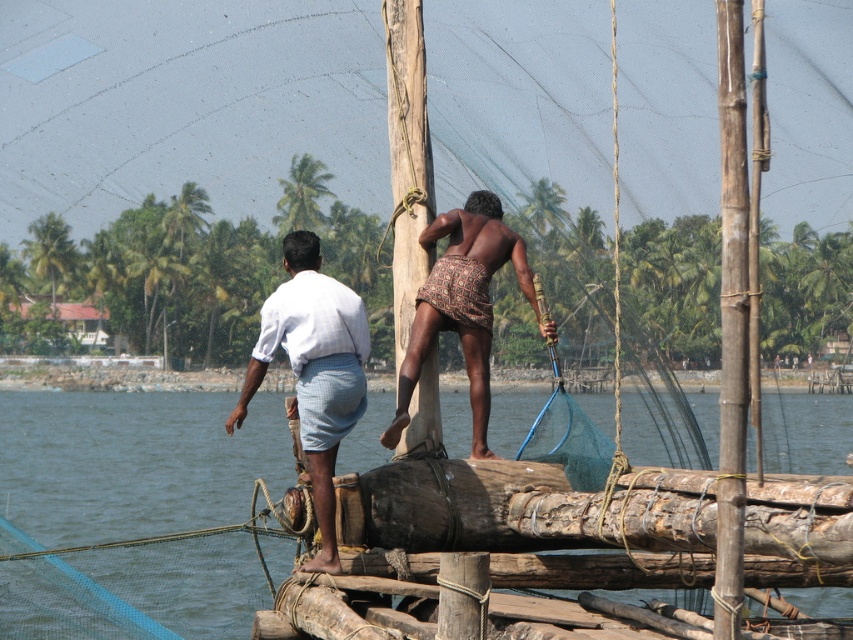
Consider the image. What is the exact coordinate of the transparent blue water at center?

The transparent blue water at center is located at point (132, 461).

You are a photographer trying to capture a closeup of the patterned fabric shorts at center while also including the transparent blue water at center in the background. Based on their positions, will the water appear in front or behind the shorts in the photo?

The transparent blue water at center is further to the viewer than patterned fabric shorts at center, so the water will appear in front of the shorts in the photo.